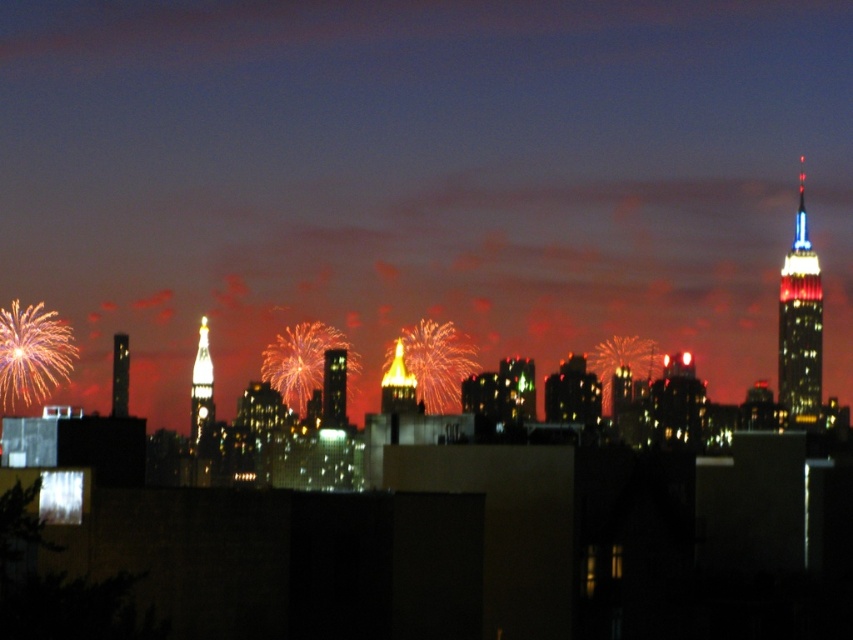
Does blue glass skyscraper at right appear on the left side of shiny glass skyscraper at center?

No, blue glass skyscraper at right is not to the left of shiny glass skyscraper at center.

I want to click on blue glass skyscraper at right, so click(799, 321).

Is point (807, 273) positioned in front of point (341, 406)?

No, it is not.

Locate an element on the screen. Image resolution: width=853 pixels, height=640 pixels. blue glass skyscraper at right is located at coordinates (799, 321).

Is point (198, 420) behind point (398, 348)?

Yes, point (198, 420) is behind point (398, 348).

Is shiny gold clock tower at center shorter than golden glass spire at center?

No.

Measure the distance between shiny gold clock tower at center and camera.

The distance of shiny gold clock tower at center from camera is 657.09 meters.

The image size is (853, 640). What are the coordinates of `shiny gold clock tower at center` in the screenshot? It's located at (201, 387).

Is shiny glass skyscraper at center closer to the viewer compared to metallic glass skyscraper at left?

Yes, it is.

Which is more to the left, shiny glass skyscraper at center or metallic glass skyscraper at left?

From the viewer's perspective, metallic glass skyscraper at left appears more on the left side.

Find the location of a particular element. The image size is (853, 640). shiny glass skyscraper at center is located at coordinates (334, 388).

You are a GUI agent. You are given a task and a screenshot of the screen. Output one action in this format:
    pyautogui.click(x=<x>, y=<y>)
    Task: Click on the shiny glass skyscraper at center
    This screenshot has width=853, height=640.
    Given the screenshot: What is the action you would take?
    pyautogui.click(x=334, y=388)